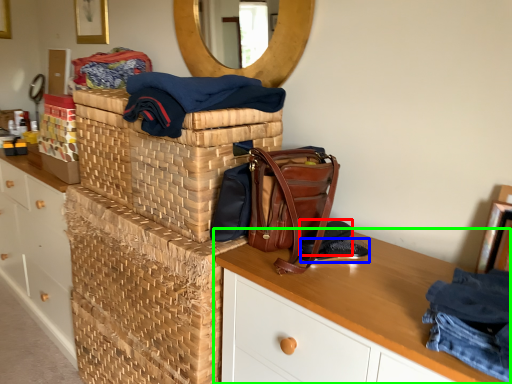
Question: Considering the real-world distances, which object is farthest from shoe (highlighted by a red box)? shoe (highlighted by a blue box) or desk (highlighted by a green box)?

Choices:
 (A) shoe
 (B) desk

Answer: (B)